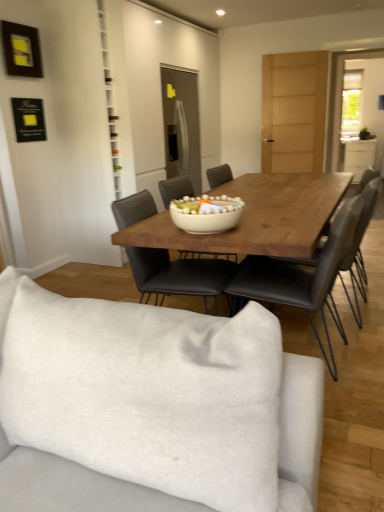
Question: Should I look upward or downward to see clear glass door at upper right?

Choices:
 (A) up
 (B) down

Answer: (A)

Question: Should I look upward or downward to see white fabric studio couch at lower center?

Choices:
 (A) down
 (B) up

Answer: (A)

Question: Is white glossy bowl at center facing towards white glossy cabinet at right?

Choices:
 (A) no
 (B) yes

Answer: (B)

Question: Is white glossy bowl at center smaller than white glossy cabinet at right?

Choices:
 (A) yes
 (B) no

Answer: (A)

Question: Is white glossy bowl at center shorter than white glossy cabinet at right?

Choices:
 (A) no
 (B) yes

Answer: (B)

Question: From the image's perspective, is white glossy bowl at center located beneath white glossy cabinet at right?

Choices:
 (A) no
 (B) yes

Answer: (B)

Question: Considering the relative positions of white glossy bowl at center and white glossy cabinet at right in the image provided, is white glossy bowl at center to the left of white glossy cabinet at right from the viewer's perspective?

Choices:
 (A) no
 (B) yes

Answer: (B)

Question: Can white glossy cabinet at right be found inside white glossy bowl at center?

Choices:
 (A) yes
 (B) no

Answer: (B)

Question: Does white glossy bowl at center have a lesser height compared to wooden picture frame at upper left?

Choices:
 (A) yes
 (B) no

Answer: (A)

Question: Considering the relative positions of white glossy bowl at center and wooden picture frame at upper left in the image provided, is white glossy bowl at center to the left of wooden picture frame at upper left from the viewer's perspective?

Choices:
 (A) yes
 (B) no

Answer: (B)

Question: Can we say white glossy bowl at center lies outside wooden picture frame at upper left?

Choices:
 (A) yes
 (B) no

Answer: (A)

Question: Is white glossy bowl at center facing towards wooden picture frame at upper left?

Choices:
 (A) no
 (B) yes

Answer: (A)

Question: Is white glossy bowl at center facing away from wooden picture frame at upper left?

Choices:
 (A) no
 (B) yes

Answer: (A)

Question: Is the depth of white glossy bowl at center less than that of wooden picture frame at upper left?

Choices:
 (A) yes
 (B) no

Answer: (A)

Question: From a real-world perspective, does white fabric studio couch at lower center sit lower than white glossy bowl at center?

Choices:
 (A) yes
 (B) no

Answer: (A)